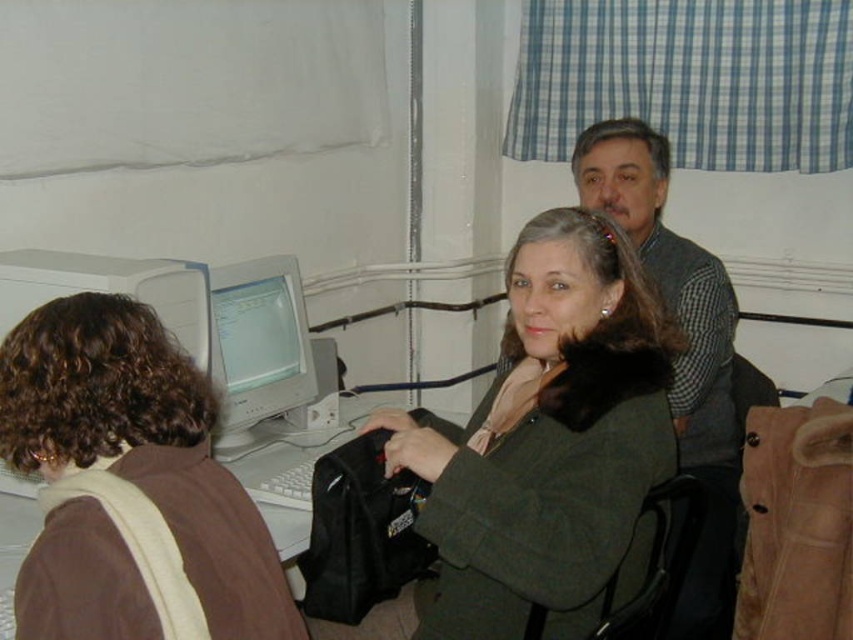
Is gray wool sweater at upper right below matte gray monitor at center?

Indeed, gray wool sweater at upper right is positioned under matte gray monitor at center.

Is gray wool sweater at upper right smaller than matte gray monitor at center?

No.

Is point (685, 330) positioned behind point (291, 278)?

No.

You are a GUI agent. You are given a task and a screenshot of the screen. Output one action in this format:
    pyautogui.click(x=<x>, y=<y>)
    Task: Click on the gray wool sweater at upper right
    The width and height of the screenshot is (853, 640).
    Given the screenshot: What is the action you would take?
    pyautogui.click(x=680, y=352)

Is brown fuzzy jacket at left in front of gray wool sweater at upper right?

Yes.

Can you confirm if brown fuzzy jacket at left is positioned above gray wool sweater at upper right?

No, brown fuzzy jacket at left is not above gray wool sweater at upper right.

This screenshot has height=640, width=853. Describe the element at coordinates (143, 445) in the screenshot. I see `brown fuzzy jacket at left` at that location.

The width and height of the screenshot is (853, 640). In order to click on brown fuzzy jacket at left in this screenshot , I will do `click(143, 445)`.

Between brown fuzzy jacket at left and matte gray monitor at center, which one is positioned higher?

Positioned higher is matte gray monitor at center.

Which of these two, brown fuzzy jacket at left or matte gray monitor at center, stands taller?

Standing taller between the two is matte gray monitor at center.

Is point (18, 326) positioned after point (231, 401)?

No.

This screenshot has height=640, width=853. I want to click on brown fuzzy jacket at left, so click(143, 445).